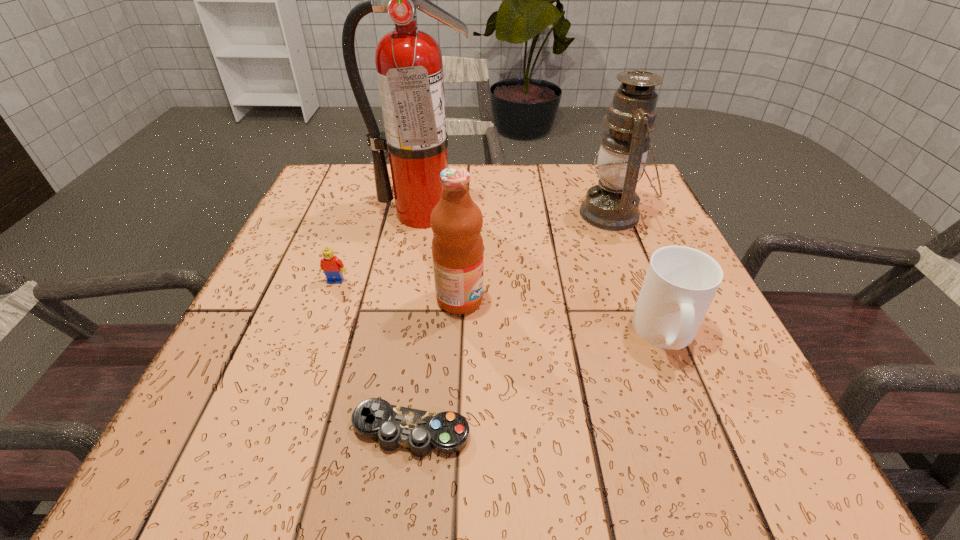
The height and width of the screenshot is (540, 960). What are the coordinates of `object at the far right corner` in the screenshot? It's located at (612, 204).

Locate an element on the screen. The image size is (960, 540). blank space at the far edge of the desktop is located at coordinates (470, 170).

Where is `free space at the near edge of the desktop`? This screenshot has height=540, width=960. free space at the near edge of the desktop is located at coordinates (592, 435).

In the image, there is a desktop. Identify the location of vacant space at the left edge. The width and height of the screenshot is (960, 540). (268, 299).

I want to click on vacant region at the right edge of the desktop, so click(x=618, y=235).

Where is `free space at the near left corner`? This screenshot has height=540, width=960. free space at the near left corner is located at coordinates (250, 446).

This screenshot has width=960, height=540. What are the coordinates of `free area in between the fire extinguisher and the leftmost object` in the screenshot? It's located at (379, 247).

Find the location of a particular element. Image resolution: width=960 pixels, height=540 pixels. free point between the fire extinguisher and the third shortest object is located at coordinates (544, 273).

Where is `empty space that is in between the shortest object and the tallest object`? The height and width of the screenshot is (540, 960). empty space that is in between the shortest object and the tallest object is located at coordinates (417, 322).

Find the location of a particular element. The width and height of the screenshot is (960, 540). vacant space in between the fruit juice and the second tallest object is located at coordinates (537, 256).